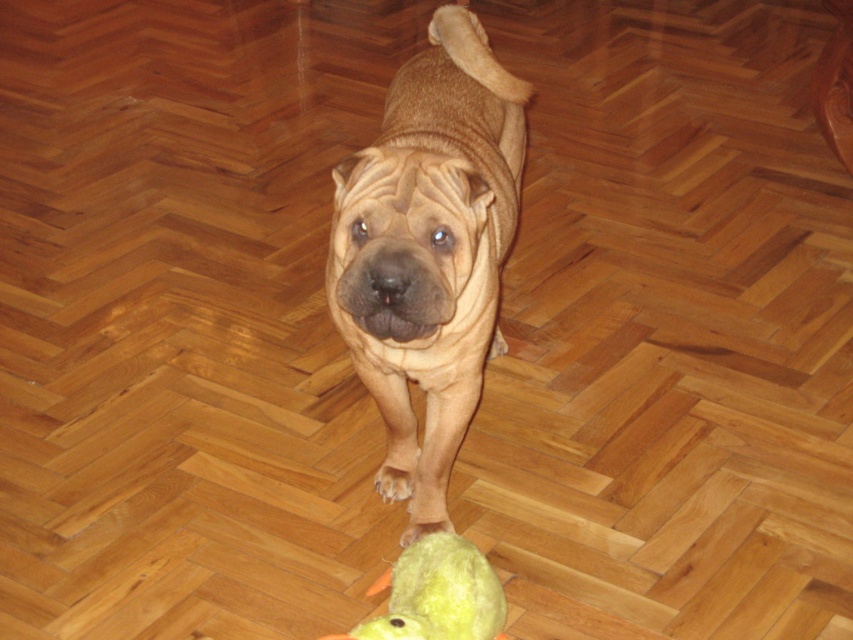
You are a photographer setting up a shot of the brown matte dog at center and the yellow plush duck at lower center. You want to focus on the dog first. Which object should you adjust your camera focus on first?

The brown matte dog at center is closer to the viewer than the yellow plush duck at lower center, so you should focus on the brown matte dog at center first to ensure it is in sharp focus before adjusting for the duck.